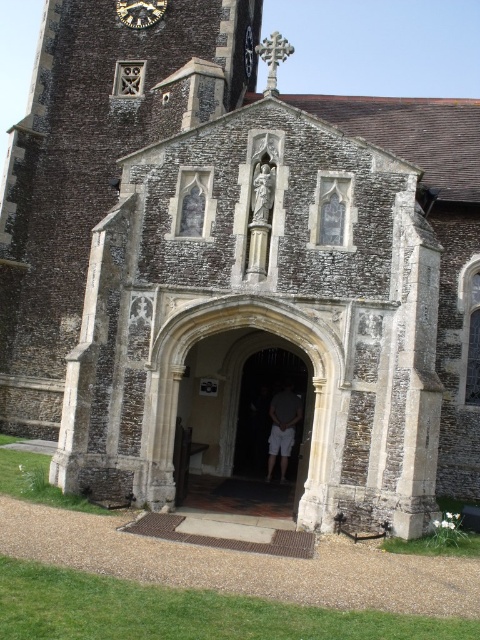
You are standing at the entrance of a historic stone church and notice the light gray cotton shorts at center and the metallic clock face at upper center. How far apart are these two objects?

The distance between the light gray cotton shorts at center and the metallic clock face at upper center is 46.57 meters.

You are a tourist visiting the historic church and notice the light gray cotton shorts at center and the metallic clock face at upper center. Which object appears larger in the image?

The metallic clock face at upper center appears larger than the light gray cotton shorts at center.